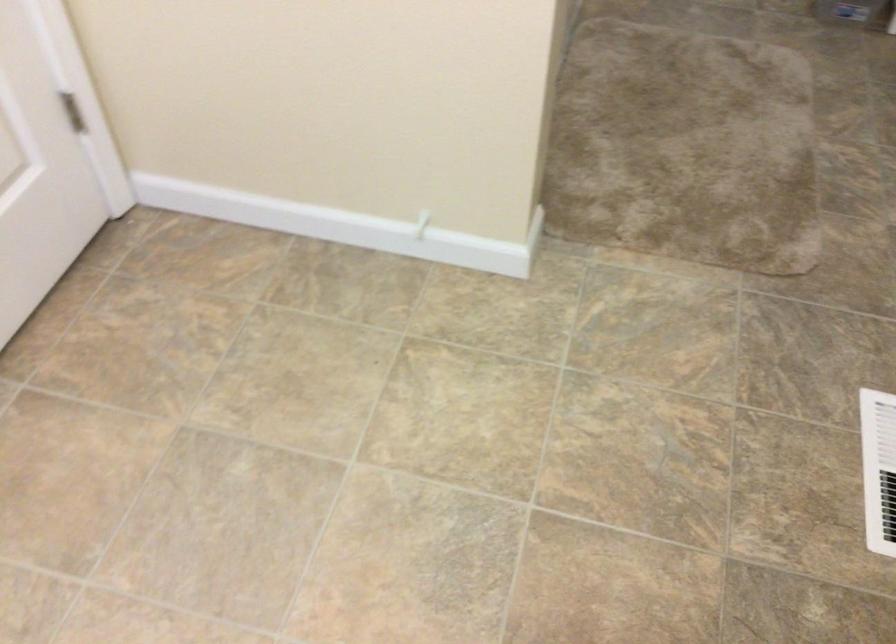
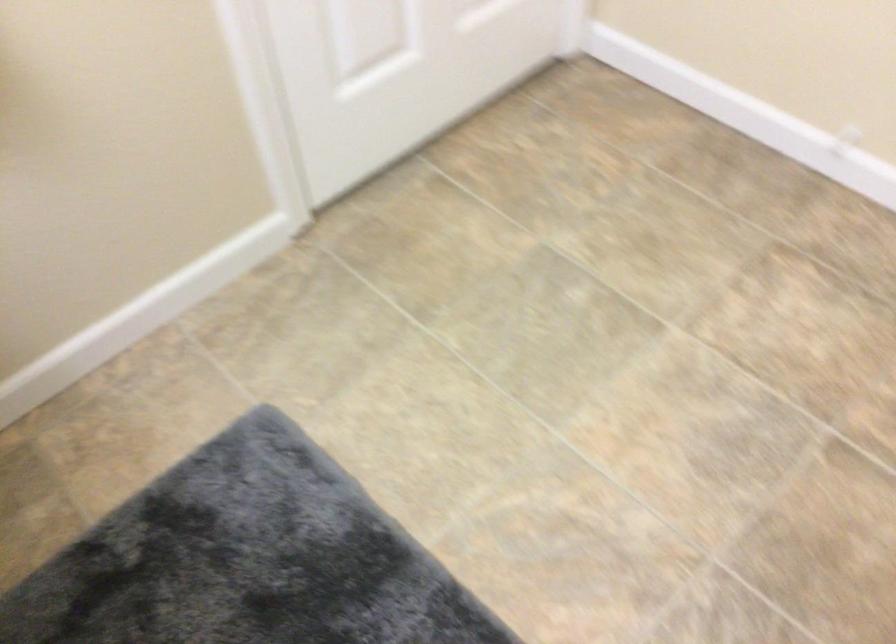
Question: The camera is either moving clockwise (left) or counter-clockwise (right) around the object. The first image is from the beginning of the video and the second image is from the end. Is the camera moving left or right when shooting the video?

Choices:
 (A) Left
 (B) Right

Answer: (B)